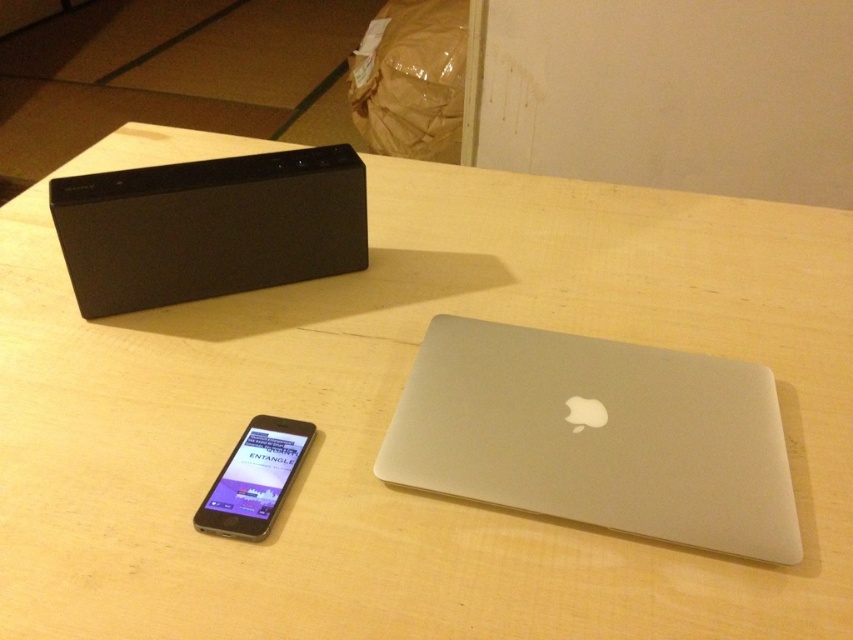
Can you confirm if sleek silver laptop at center is thinner than black matte speaker at upper left?

In fact, sleek silver laptop at center might be wider than black matte speaker at upper left.

Between point (764, 486) and point (148, 237), which one is positioned in front?

Positioned in front is point (764, 486).

The height and width of the screenshot is (640, 853). Identify the location of sleek silver laptop at center. (596, 435).

Does sleek silver laptop at center have a larger size compared to satin black ipod at lower left?

Correct, sleek silver laptop at center is larger in size than satin black ipod at lower left.

Does sleek silver laptop at center have a smaller size compared to satin black ipod at lower left?

No, sleek silver laptop at center is not smaller than satin black ipod at lower left.

Does point (769, 372) lie in front of point (274, 488)?

No, (769, 372) is behind (274, 488).

Where is `sleek silver laptop at center`? Image resolution: width=853 pixels, height=640 pixels. sleek silver laptop at center is located at coordinates (596, 435).

Does black matte speaker at upper left have a greater width compared to satin black ipod at lower left?

Yes, black matte speaker at upper left is wider than satin black ipod at lower left.

Does point (180, 182) come behind point (253, 458)?

Yes, it is.

The width and height of the screenshot is (853, 640). Identify the location of black matte speaker at upper left. click(209, 227).